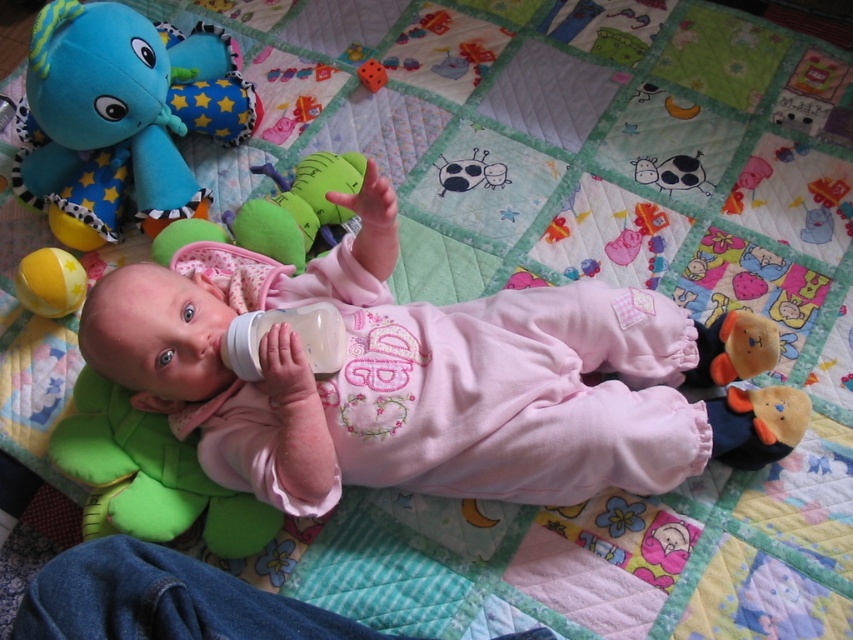
From the picture: Please provide the 2D coordinates of the transparent plastic baby bottle at center in the image. The coordinates should be in the format of a point with two decimal numbers separated by a comma, like 0.5,0.5.

The 2D coordinates of the transparent plastic baby bottle at center are at point (292,330).

Consider the image. You are a parent looking at the baby in the image. You see the green plush turtle at center and the yellow rubber ball at lower left. Which toy is nearer to you?

The green plush turtle at center is closer to the viewer than the yellow rubber ball at lower left.

You are a parent holding a green plush cow at upper right and a transparent plastic baby bottle at center. You want to place both items on a shelf. If the shelf has a height limit of 15 cm, can both items fit vertically?

The transparent plastic baby bottle at center is taller than the green plush cow at upper right. Since the shelf has a height limit of 15 cm, if the bottle exceeds this limit, it won directly fit. However, the description only states the bottle is taller than the cow but doesn provide exact measurements. Without knowing the exact heights, it is impossible to determine if both items will fit vertically on the shelf.